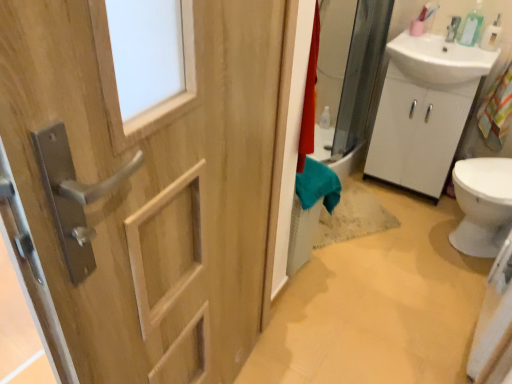
Question: Considering their positions, is natural wood door at left located in front of or behind clear plastic soap dispenser at upper right?

Choices:
 (A) front
 (B) behind

Answer: (A)

Question: From the image's perspective, is natural wood door at left above or below clear plastic soap dispenser at upper right?

Choices:
 (A) above
 (B) below

Answer: (B)

Question: Considering the real-world distances, which object is farthest from the clear plastic soap dispenser at upper right?

Choices:
 (A) white matte cabinet at right
 (B) white glossy sink at upper right
 (C) white plastic bottle at upper right
 (D) natural wood door at left

Answer: (D)

Question: Considering the real-world distances, which object is closest to the clear plastic soap dispenser at upper right?

Choices:
 (A) white plastic bottle at upper right
 (B) natural wood door at left
 (C) white matte cabinet at right
 (D) white glossy sink at upper right

Answer: (A)